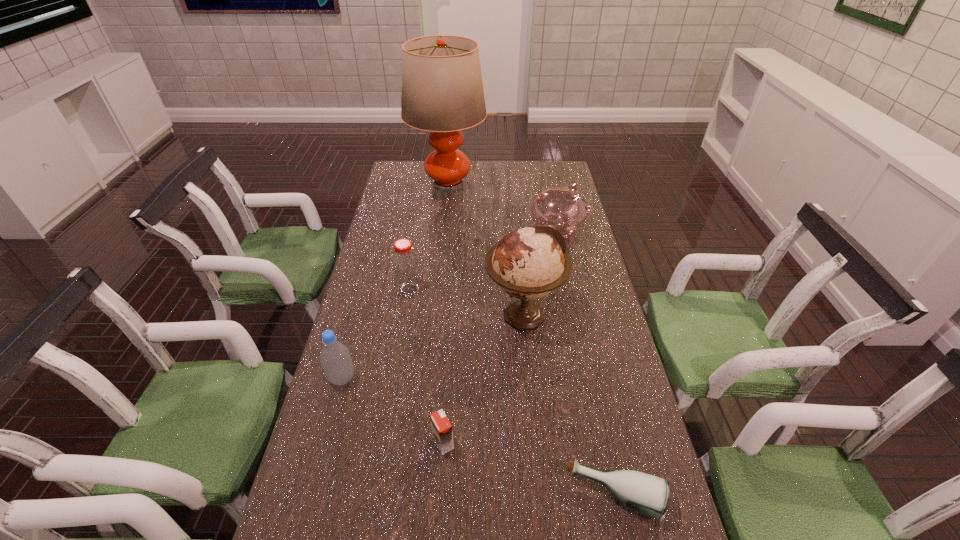
This screenshot has height=540, width=960. Identify the location of free space between the globe and the second bottle from right to left. (467, 302).

The height and width of the screenshot is (540, 960). In order to click on vacant space that is in between the lamp and the piggy bank in this screenshot , I will do `click(503, 208)`.

This screenshot has height=540, width=960. What are the coordinates of `free spot between the leftmost bottle and the piggy bank` in the screenshot? It's located at (450, 305).

Locate an element on the screen. Image resolution: width=960 pixels, height=540 pixels. vacant space that is in between the globe and the nearest object is located at coordinates (569, 406).

This screenshot has width=960, height=540. Identify the location of empty location between the second farthest bottle and the second shortest object. (393, 410).

Identify which object is the fourth closest to the farthest object. Please provide its 2D coordinates. Your answer should be formatted as a tuple, i.e. [(x, y)], where the tuple contains the x and y coordinates of a point satisfying the conditions above.

[(335, 358)]

Image resolution: width=960 pixels, height=540 pixels. In order to click on the third closest object to the leftmost bottle in this screenshot , I will do `click(528, 263)`.

Locate an element on the screen. This screenshot has height=540, width=960. bottle that is the closest to the shortest bottle is located at coordinates (335, 358).

This screenshot has height=540, width=960. I want to click on bottle that is the second closest one to the orange juice, so click(x=648, y=494).

Where is `vacant area that satisfies the following two spatial constraints: 1. on the front of the second tallest object showing Asia; 2. on the left side of the shortest object`? The width and height of the screenshot is (960, 540). vacant area that satisfies the following two spatial constraints: 1. on the front of the second tallest object showing Asia; 2. on the left side of the shortest object is located at coordinates (541, 496).